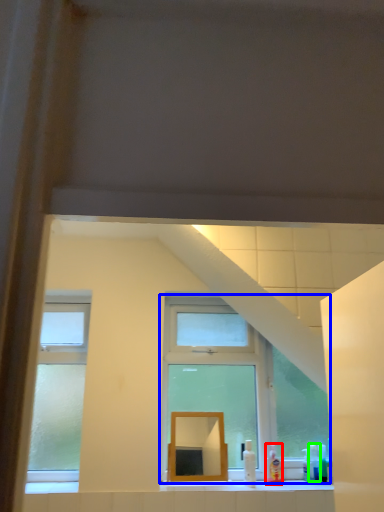
Question: Which is farther away from toiletry (highlighted by a red box)? window (highlighted by a blue box) or toiletry (highlighted by a green box)?

Choices:
 (A) window
 (B) toiletry

Answer: (A)